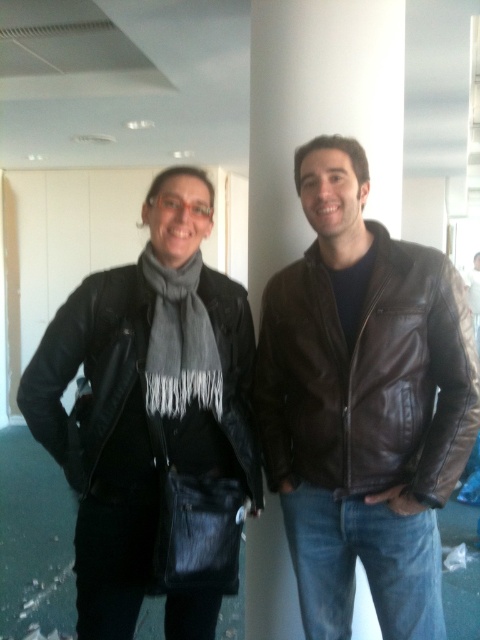
Question: Which object appears farthest from the camera in this image?

Choices:
 (A) gray woolen scarf at center
 (B) black leather jacket at left

Answer: (B)

Question: Which is farther from the gray woolen scarf at center?

Choices:
 (A) brown leather jacket at center
 (B) black leather jacket at left

Answer: (A)

Question: Among these points, which one is farthest from the camera?

Choices:
 (A) (96, 349)
 (B) (156, 371)

Answer: (A)

Question: Is brown leather jacket at center wider than black leather jacket at left?

Choices:
 (A) yes
 (B) no

Answer: (B)

Question: Is brown leather jacket at center in front of black leather jacket at left?

Choices:
 (A) yes
 (B) no

Answer: (A)

Question: Can you confirm if brown leather jacket at center is wider than black leather jacket at left?

Choices:
 (A) no
 (B) yes

Answer: (A)